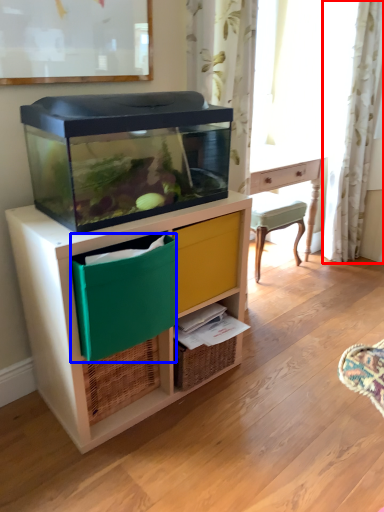
Question: Which object is further to the camera taking this photo, curtain (highlighted by a red box) or storage box (highlighted by a blue box)?

Choices:
 (A) curtain
 (B) storage box

Answer: (A)